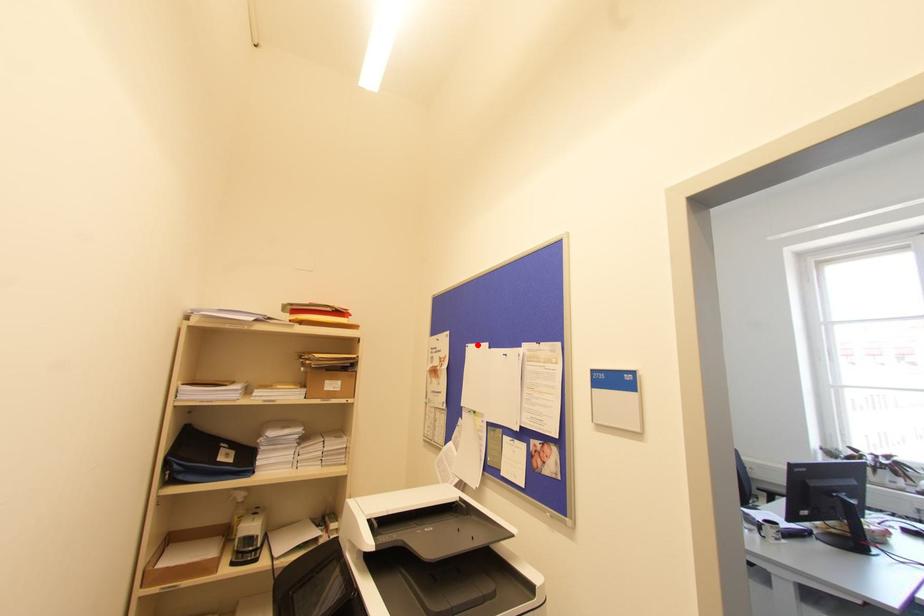
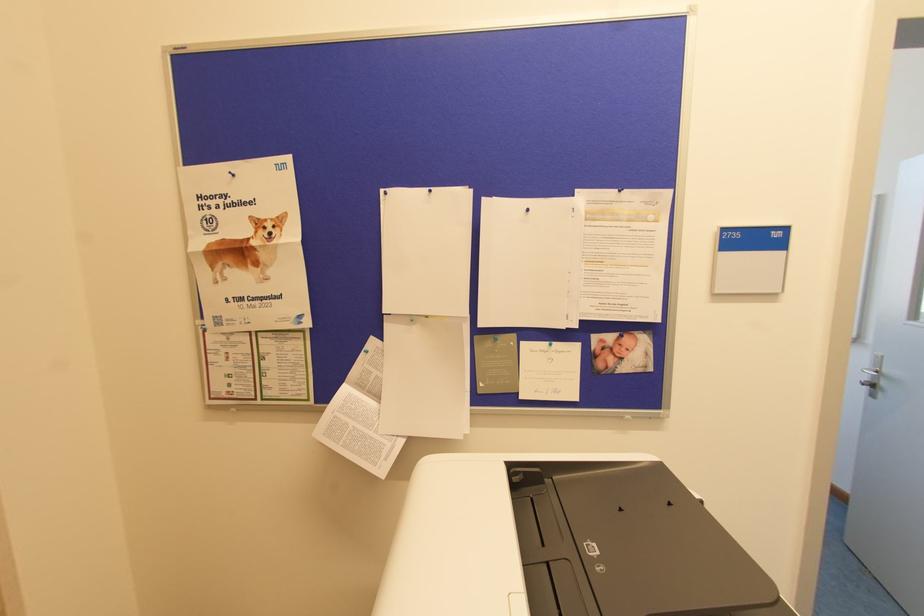
Where in the second image is the point corresponding to the highlighted location from the first image?

(430, 191)